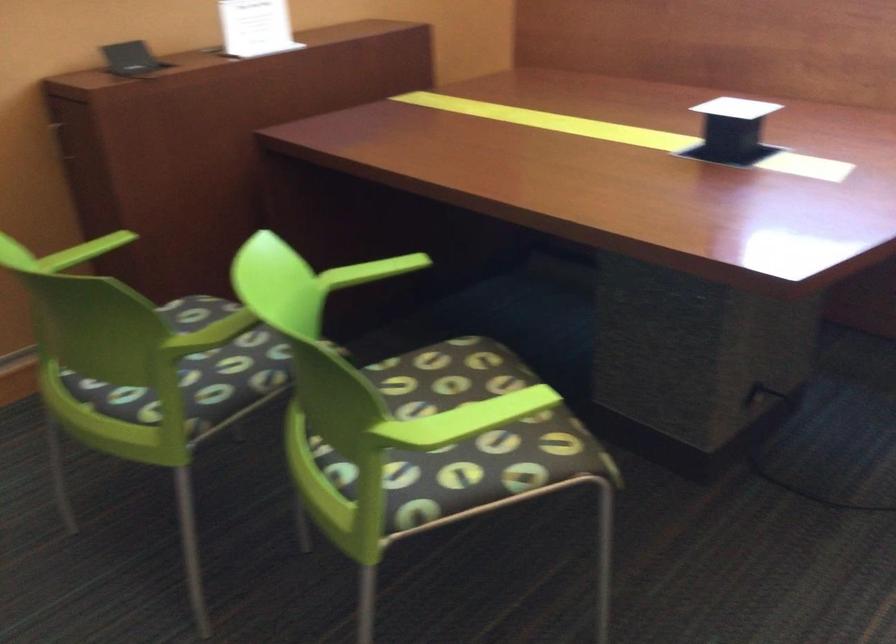
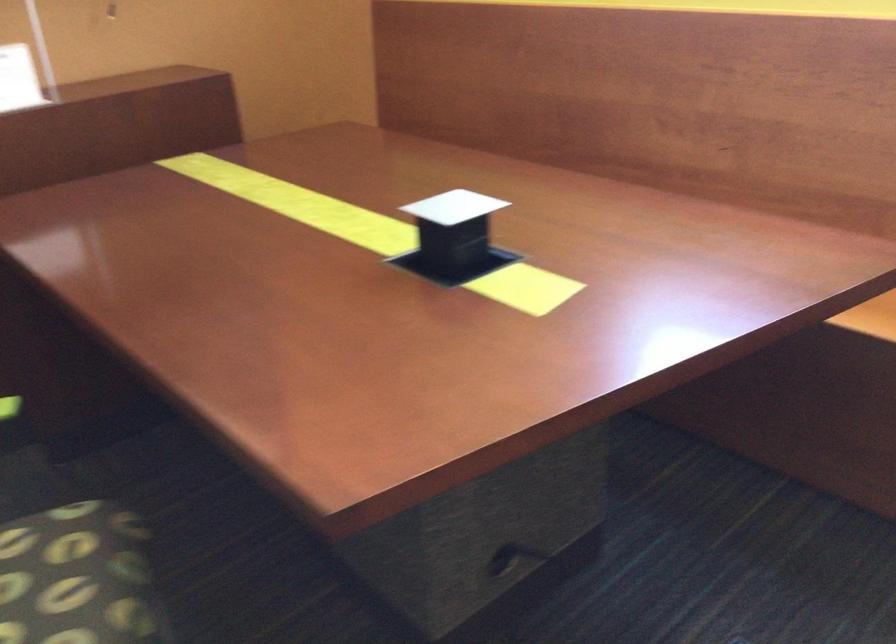
In the second image, find the point that corresponds to [495,386] in the first image.

(74, 576)